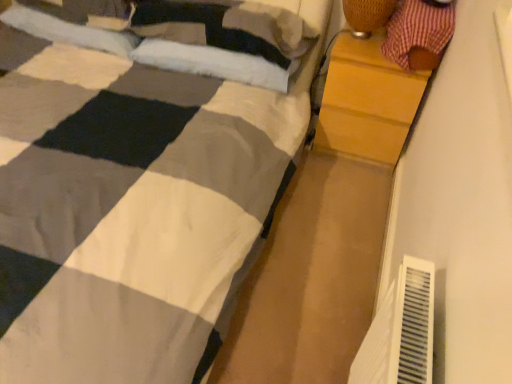
What are the coordinates of `free space between woven bamboo lampshade at upper right and red plaid fabric at upper right` in the screenshot? It's located at (359, 52).